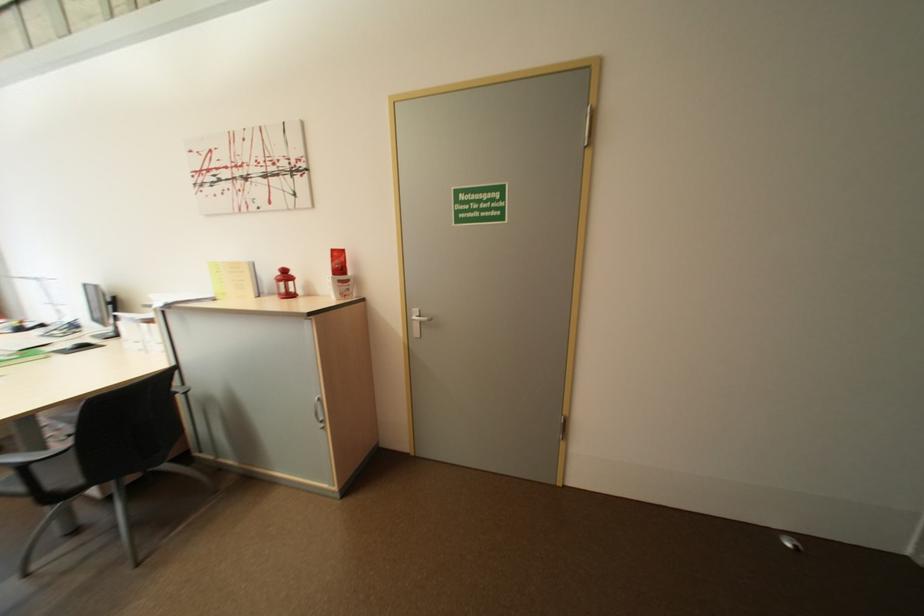
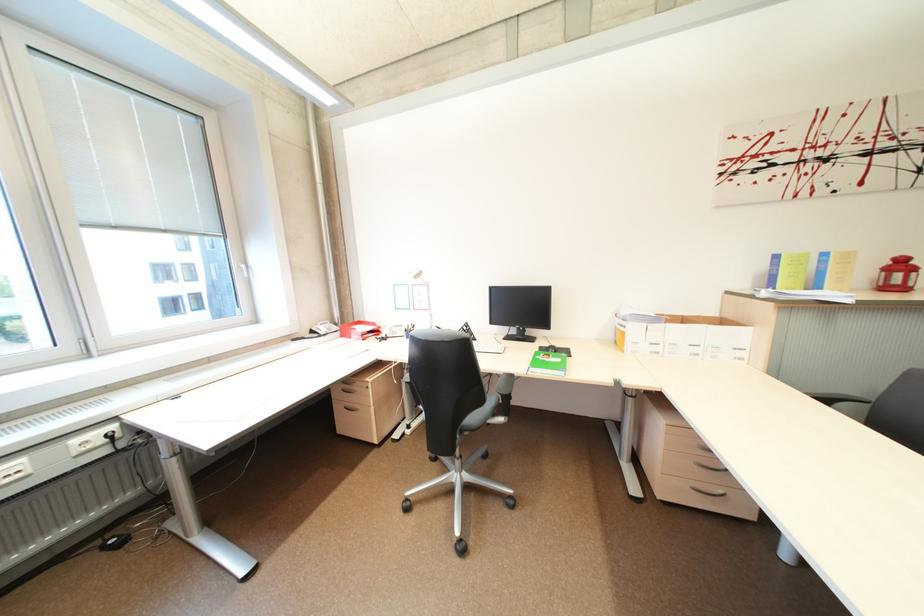
The point at (295, 276) is marked in the first image. Where is the corresponding point in the second image?

(910, 265)